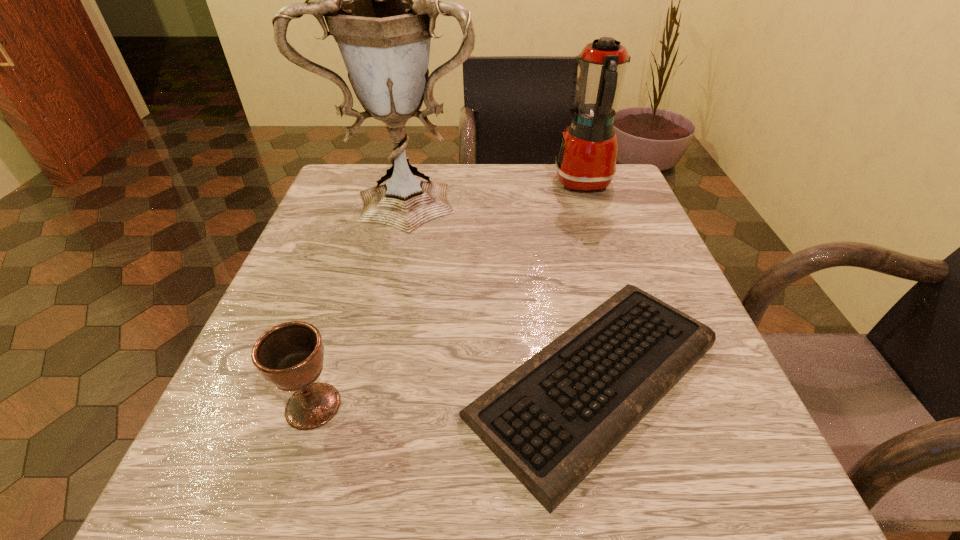
Find the location of a particular element. This screenshot has width=960, height=540. trophy cup is located at coordinates (380, 0).

Where is `food processor`? food processor is located at coordinates (586, 160).

Find the location of `chalice`. chalice is located at coordinates (290, 356).

At what (x,y) coordinates should I click in order to perform the action: click on computer keyboard. Please return your answer as a coordinate pair (x, y). Looking at the image, I should click on (551, 421).

Find the location of a particular element. vacant area located on the front of the tallest object is located at coordinates (388, 290).

Image resolution: width=960 pixels, height=540 pixels. Find the location of `blank space located 0.200m on the controls of the food processor`. blank space located 0.200m on the controls of the food processor is located at coordinates (472, 184).

Where is `free region located 0.220m on the controls of the food processor`? Image resolution: width=960 pixels, height=540 pixels. free region located 0.220m on the controls of the food processor is located at coordinates (464, 184).

What are the coordinates of `free space located 0.390m on the controls of the food processor` in the screenshot? It's located at click(394, 184).

This screenshot has height=540, width=960. In order to click on blank space located 0.390m on the back of the chalice in this screenshot , I will do `click(370, 227)`.

The image size is (960, 540). I want to click on blank space located on the back of the shortest object, so click(552, 192).